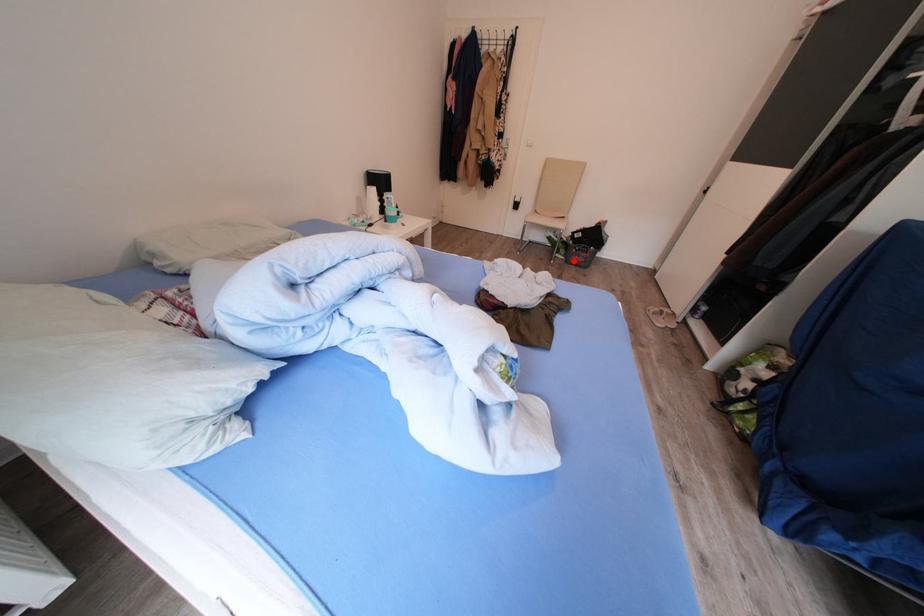
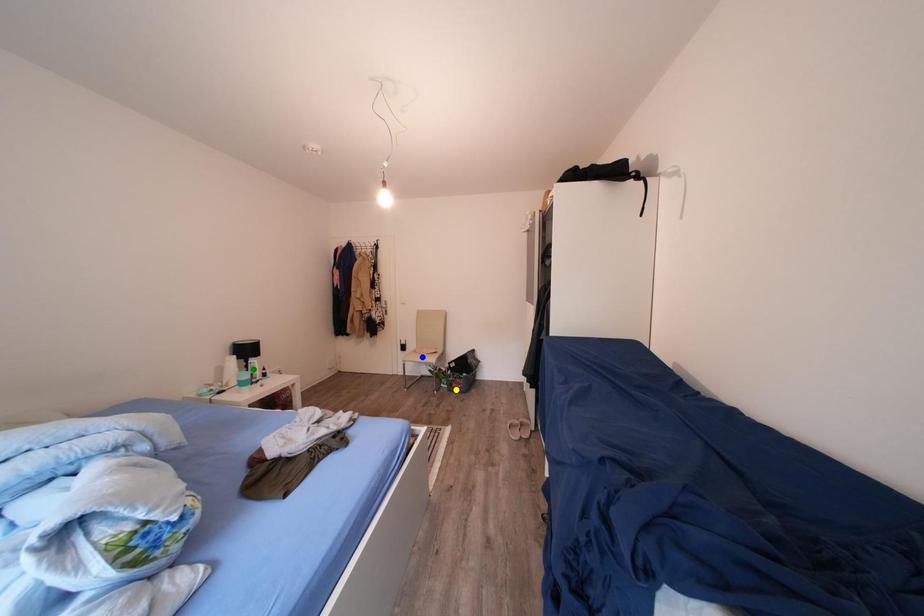
Question: I am providing you with two images of the same scene from different viewpoints. A red point is marked on the first image. You are given multiple points on the second image. In image 2, which mark is for the same physical point as the one in image 1?

Choices:
 (A) blue point
 (B) green point
 (C) yellow point

Answer: (C)